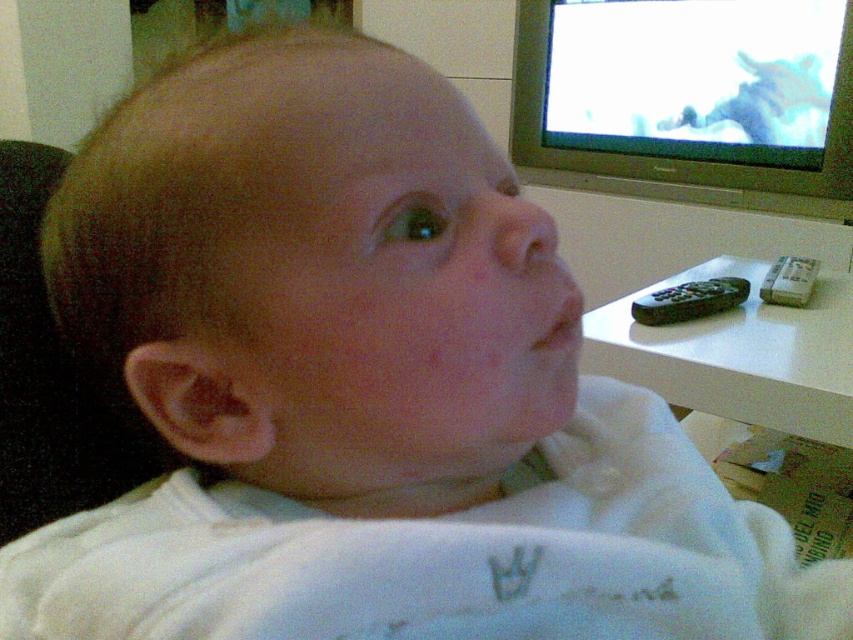
Which is behind, point (657, 157) or point (780, 262)?

Positioned behind is point (657, 157).

Is silver plastic television at upper right bigger than gray plastic remote at right?

Correct, silver plastic television at upper right is larger in size than gray plastic remote at right.

Is point (804, 196) farther from camera compared to point (776, 291)?

Yes, point (804, 196) is farther from viewer.

Find the location of a particular element. This screenshot has height=640, width=853. silver plastic television at upper right is located at coordinates tap(675, 140).

Can you confirm if black plastic remote at right is bigger than gray plastic remote at right?

Actually, black plastic remote at right might be smaller than gray plastic remote at right.

Which is above, black plastic remote at right or gray plastic remote at right?

gray plastic remote at right is above.

Where is `black plastic remote at right`? This screenshot has width=853, height=640. black plastic remote at right is located at coordinates (689, 300).

Is white plastic table at right thinner than black plastic remote at right?

No.

Which of these two, white plastic table at right or black plastic remote at right, stands taller?

With more height is white plastic table at right.

Is point (834, 422) in front of point (653, 296)?

Yes, point (834, 422) is closer to viewer.

The height and width of the screenshot is (640, 853). What are the coordinates of `white plastic table at right` in the screenshot? It's located at (740, 355).